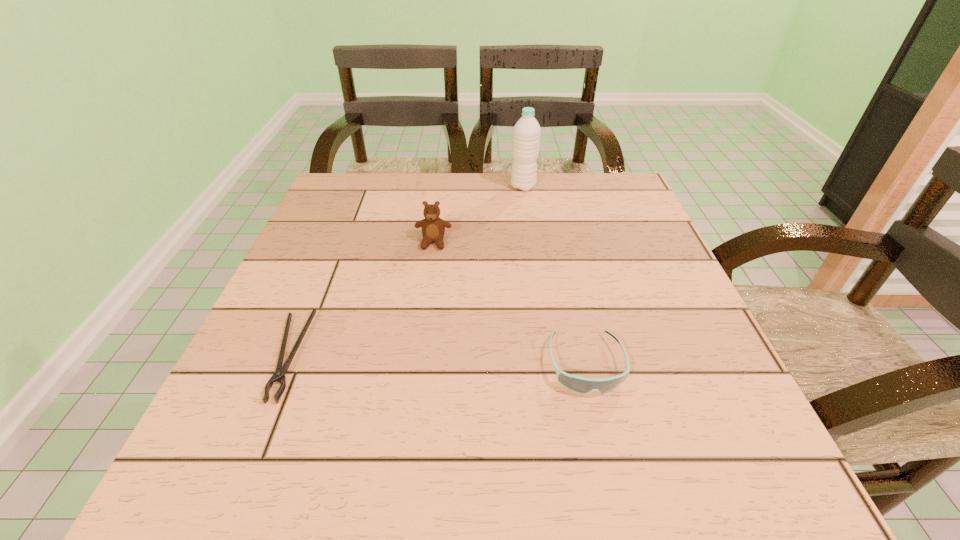
Where is `empty space that is in between the second farthest object and the tongs`? empty space that is in between the second farthest object and the tongs is located at coordinates (360, 299).

This screenshot has height=540, width=960. What are the coordinates of `free space between the third shortest object and the leftmost object` in the screenshot? It's located at (360, 299).

The width and height of the screenshot is (960, 540). Identify the location of free space between the tallest object and the second farthest object. (478, 214).

Identify the location of vacant region between the water bottle and the second object from left to right. (478, 214).

Find the location of a particular element. Image resolution: width=960 pixels, height=540 pixels. vacant region between the leftmost object and the water bottle is located at coordinates (405, 271).

Identify the location of free spot between the water bottle and the leftmost object. This screenshot has width=960, height=540. point(405,271).

This screenshot has width=960, height=540. Identify the location of empty space between the farthest object and the goggles. (555, 275).

Find the location of a particular element. The width and height of the screenshot is (960, 540). vacant area between the third object from right to left and the shortest object is located at coordinates (360, 299).

Locate an element on the screen. free space that is in between the third tallest object and the water bottle is located at coordinates (555, 275).

Identify the location of the third closest object to the water bottle. The image size is (960, 540). (279, 375).